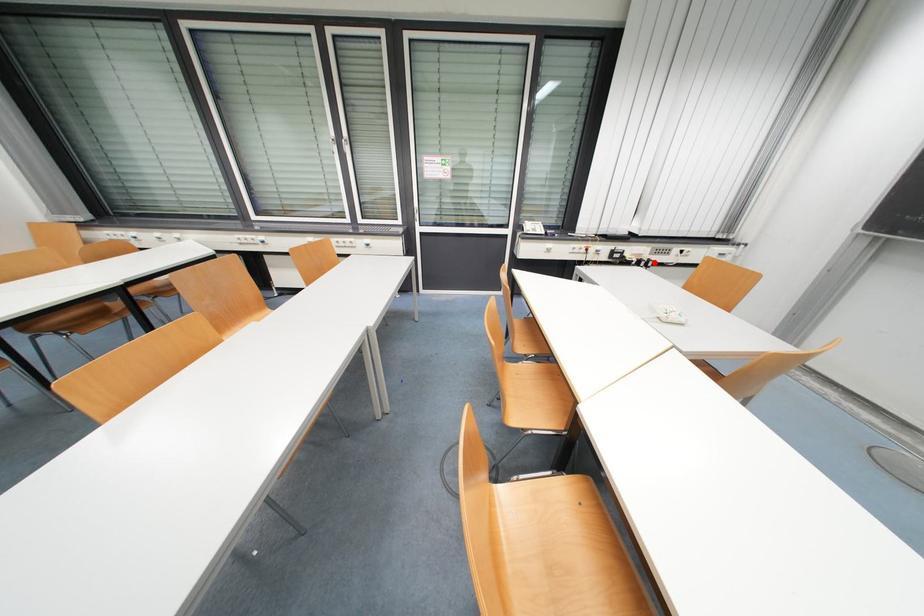
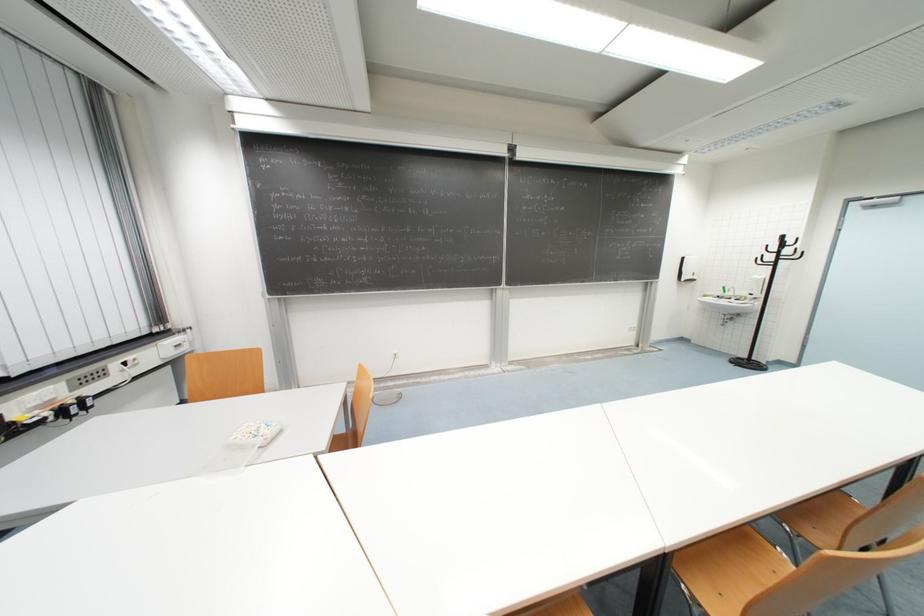
Locate, in the second image, the point that corresponds to the highlighted location in the first image.

(88, 400)